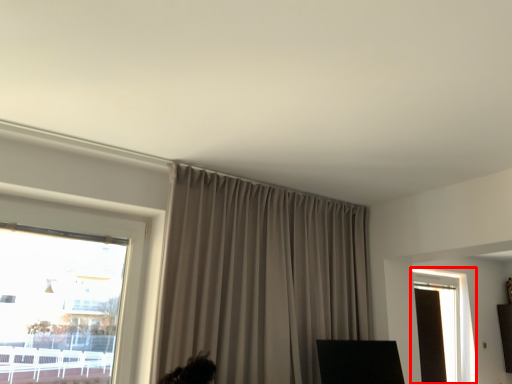
Question: From the image's perspective, where is window (annotated by the red box) located in relation to curtain in the image?

Choices:
 (A) below
 (B) above

Answer: (A)